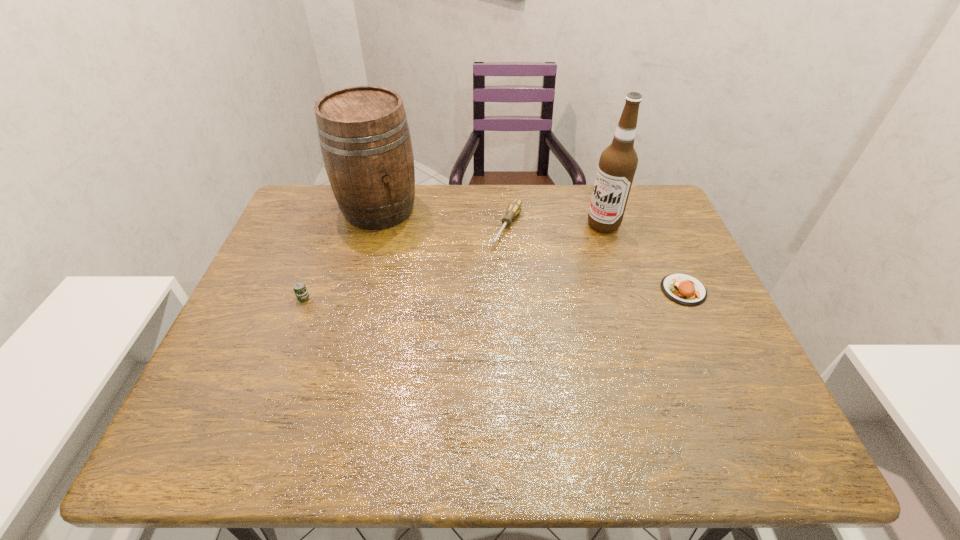
The width and height of the screenshot is (960, 540). I want to click on cider that is at the left edge, so click(x=364, y=136).

Locate an element on the screen. This screenshot has width=960, height=540. object positioned at the right edge is located at coordinates (684, 289).

At what (x,y) coordinates should I click in order to perform the action: click on object present at the far left corner. Please return your answer as a coordinate pair (x, y). Looking at the image, I should click on (364, 136).

This screenshot has height=540, width=960. In the image, there is a desktop. In order to click on vacant area at the far edge in this screenshot , I will do `click(482, 196)`.

At what (x,y) coordinates should I click in order to perform the action: click on free location at the near edge of the desktop. Please return your answer as a coordinate pair (x, y). The image size is (960, 540). Looking at the image, I should click on (582, 378).

This screenshot has height=540, width=960. Find the location of `free spot at the left edge of the desktop`. free spot at the left edge of the desktop is located at coordinates (300, 260).

You are a GUI agent. You are given a task and a screenshot of the screen. Output one action in this format:
    pyautogui.click(x=<x>, y=<y>)
    Task: Click on the vacant space at the right edge of the desktop
    
    Given the screenshot: What is the action you would take?
    pyautogui.click(x=683, y=272)

In the image, there is a desktop. Find the location of `vacant area at the near right corner`. vacant area at the near right corner is located at coordinates (722, 389).

Locate an element on the screen. unoccupied area between the cider and the alcohol is located at coordinates (492, 217).

Locate an element on the screen. This screenshot has width=960, height=540. free space between the third tallest object and the patty (food) is located at coordinates (493, 294).